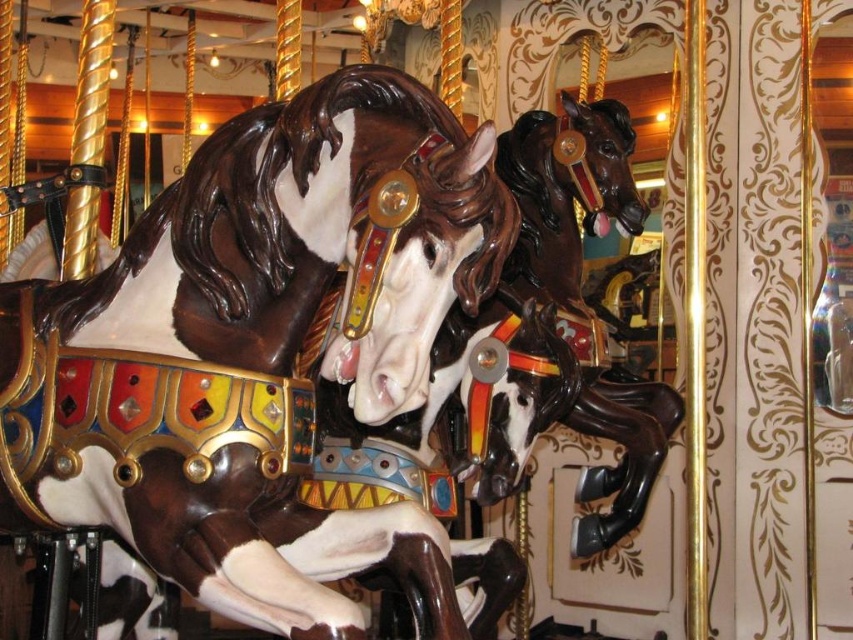
You are standing in front of a carousel and want to take a photo of the shiny brown horse at center. If your camera has a minimum focus distance of 8 feet, will you be able to take a clear photo without moving closer?

The shiny brown horse at center is 9.03 feet from the camera, which is beyond the camera minimum focus distance of 8 feet. Therefore, you can take a clear photo without moving closer.